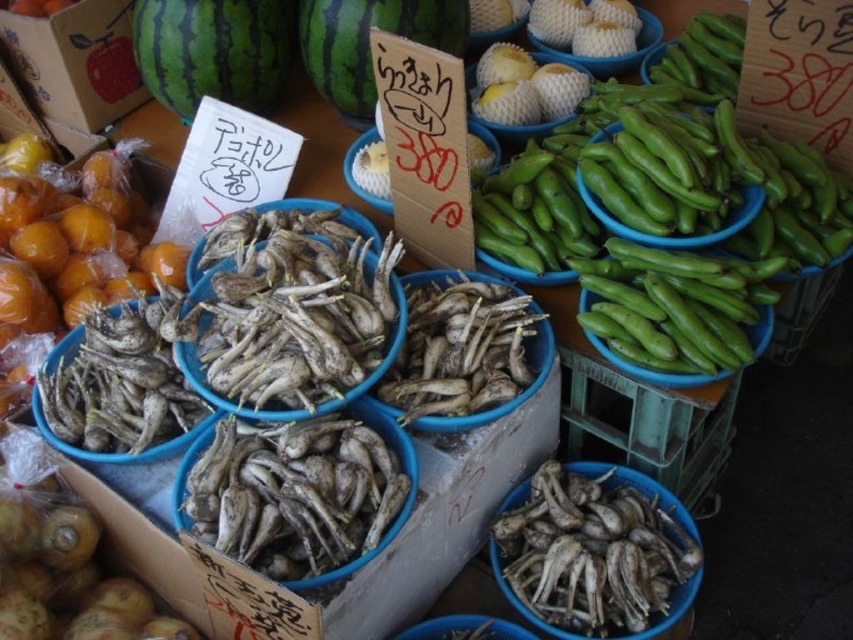
You are a customer standing at the market entrance and want to buy both the white matte root vegetables at lower center and the green striped watermelon at upper center. If you can only carry items within a 40 inch reach, can you comfortably pick both items without moving your position?

The white matte root vegetables at lower center is 38.60 inches away from the green striped watermelon at upper center, so yes, you can comfortably pick both items within your 40 inch reach since the distance between them is less than your limit.

Please provide the exact coordinates of the white matte root vegetables at lower center in the image. The coordinate system is normalized with the origin at the bottom left corner of the image. The x and y coordinates are both in the range of 0 to 1. Please answer in the format of a tuple with two decimal places, like this example format for coordinates at the center of the image would be written as 0.50, 0.50. Please do not add any other text or explanation.

The white matte root vegetables at lower center are located at coordinates (596, 550).

You are standing in the market and want to buy a watermelon. The vendor points to a spot at point (212, 51). What color is the surface at that point?

The point (212, 51) is on green striped watermelon at upper left, so the surface there is green.